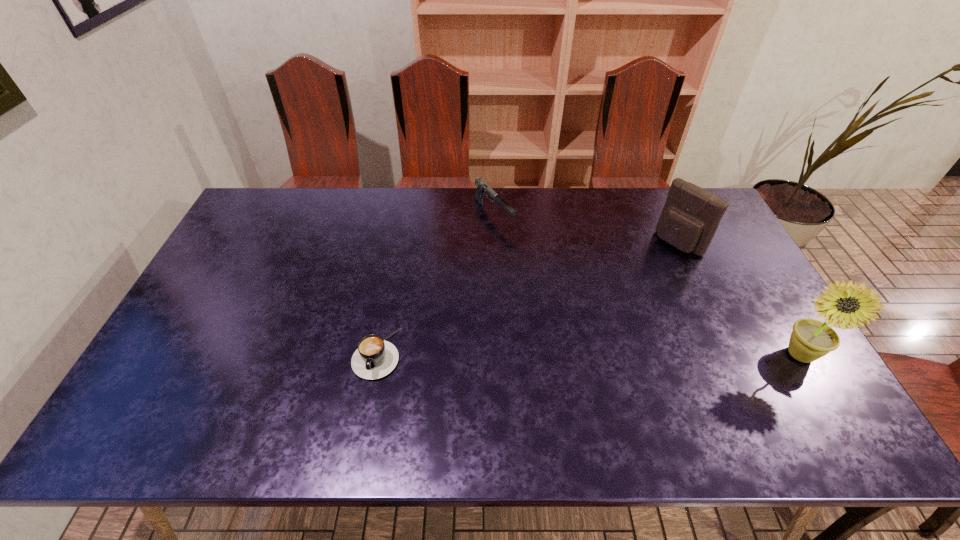
Where is `vacant spot on the desktop that is between the shortest object and the tallest object and is positioned at the muzzle end of the second shortest object`? This screenshot has height=540, width=960. vacant spot on the desktop that is between the shortest object and the tallest object and is positioned at the muzzle end of the second shortest object is located at coordinates (635, 354).

Where is `vacant space on the desktop that is between the leftmost object and the sunflower and is positioned with an open flap on the third shortest object`? vacant space on the desktop that is between the leftmost object and the sunflower and is positioned with an open flap on the third shortest object is located at coordinates 535,354.